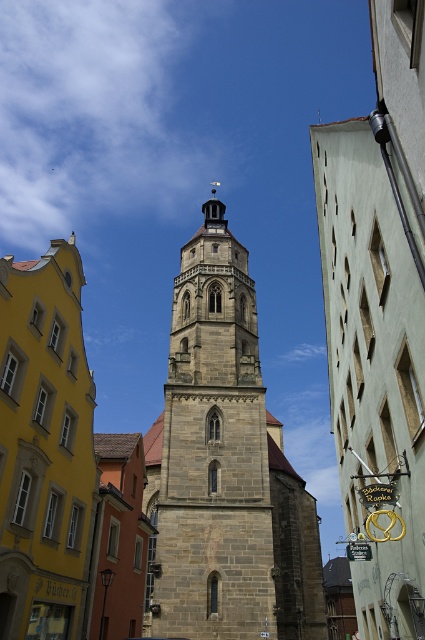
You are a tourist standing in front of the gray stone tower at center and the stone church at left. Which building is closer to your left side?

The stone church at left is closer to your left side because it is positioned to the left of the gray stone tower at center.

Looking at this image, you are an architect visiting a European town and want to compare the heights of the gray stone tower at center and the stone church at left. Which one is taller?

The gray stone tower at center is much taller than the stone church at left.

You are a tourist standing in front of the gray stone tower at center and the stone church at left. Which structure is positioned higher up in the image?

The gray stone tower at center is located above the stone church at left in the image.